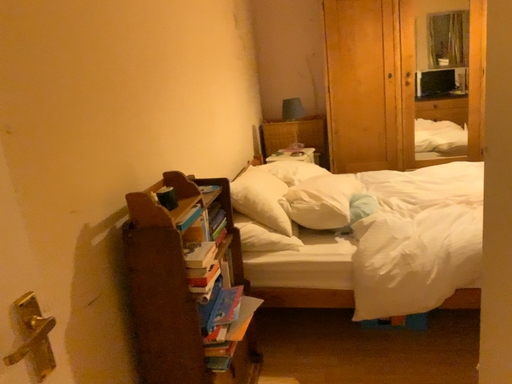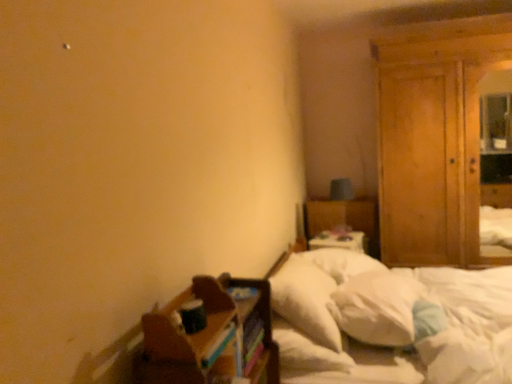
Question: How did the camera likely rotate when shooting the video?

Choices:
 (A) rotated downward
 (B) rotated upward

Answer: (B)